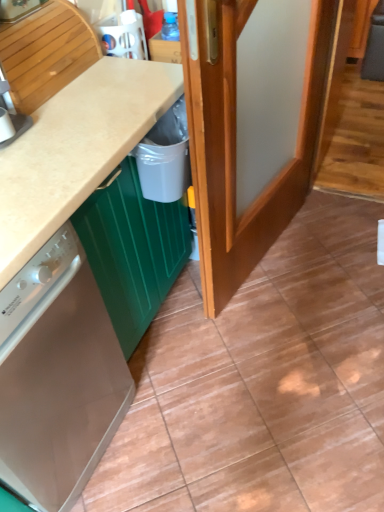
Find the location of a particular element. brushed metal dishwasher at left is located at coordinates (18, 9).

Image resolution: width=384 pixels, height=512 pixels. I want to click on beige matte countertop at center, so click(x=76, y=149).

What do you see at coordinates (236, 144) in the screenshot? The width and height of the screenshot is (384, 512). I see `wooden door at center` at bounding box center [236, 144].

The height and width of the screenshot is (512, 384). Describe the element at coordinates (165, 157) in the screenshot. I see `white plastic bin at lower center` at that location.

Locate an element on the screen. This screenshot has height=512, width=384. brushed metal dishwasher at left is located at coordinates (18, 9).

Can you see satin white dishwasher at lower left touching beige matte countertop at center?

satin white dishwasher at lower left is not next to beige matte countertop at center, and they're not touching.

From a real-world perspective, is satin white dishwasher at lower left located beneath beige matte countertop at center?

No.

From the image's perspective, is satin white dishwasher at lower left positioned above or below beige matte countertop at center?

satin white dishwasher at lower left is below beige matte countertop at center.

Is satin white dishwasher at lower left oriented away from beige matte countertop at center?

No, satin white dishwasher at lower left is not facing the opposite direction of beige matte countertop at center.

Who is taller, wooden door at center or brushed metal dishwasher at left?

wooden door at center.

From a real-world perspective, who is located higher, wooden door at center or brushed metal dishwasher at left?

brushed metal dishwasher at left is physically above.

How distant is wooden door at center from brushed metal dishwasher at left?

wooden door at center and brushed metal dishwasher at left are 86.07 centimeters apart.

Based on their sizes in the image, would you say wooden door at center is bigger or smaller than brushed metal dishwasher at left?

Clearly, wooden door at center is larger in size than brushed metal dishwasher at left.

Considering the relative positions of brushed metal dishwasher at left and beige matte countertop at center in the image provided, is brushed metal dishwasher at left in front of beige matte countertop at center?

No, brushed metal dishwasher at left is further to the viewer.

From the image's perspective, relative to beige matte countertop at center, is brushed metal dishwasher at left above or below?

From the image's perspective, brushed metal dishwasher at left appears above beige matte countertop at center.

Does point (16, 16) come behind point (148, 101)?

That is True.

Considering the relative positions of brushed metal dishwasher at left and beige matte countertop at center in the image provided, is brushed metal dishwasher at left to the right of beige matte countertop at center from the viewer's perspective?

No.

In the image, is white plastic bin at lower center on the left side or the right side of beige matte countertop at center?

white plastic bin at lower center is positioned on beige matte countertop at center's right side.

Considering the positions of objects white plastic bin at lower center and beige matte countertop at center in the image provided, who is in front, white plastic bin at lower center or beige matte countertop at center?

Positioned in front is beige matte countertop at center.

Between point (179, 17) and point (163, 175), which one is positioned behind?

The point (163, 175) is behind.

Consider the image. Is there a large distance between wooden door at center and white plastic bin at lower center?

That's not correct — wooden door at center is a little close to white plastic bin at lower center.

Could you tell me if wooden door at center is turned towards white plastic bin at lower center?

No, wooden door at center is not aimed at white plastic bin at lower center.

Does wooden door at center have a larger size compared to white plastic bin at lower center?

Correct, wooden door at center is larger in size than white plastic bin at lower center.

From the image's perspective, is brushed metal dishwasher at left located beneath white plastic bin at lower center?

No.

At what (x,y) coordinates should I click in order to perform the action: click on kitchen appliance that is on the left side of white plastic bin at lower center. Please return your answer as a coordinate pair (x, y). The height and width of the screenshot is (512, 384). Looking at the image, I should click on [x=18, y=9].

Between brushed metal dishwasher at left and white plastic bin at lower center, which one appears on the right side from the viewer's perspective?

white plastic bin at lower center.

Looking at this image, between brushed metal dishwasher at left and white plastic bin at lower center, which one has larger width?

brushed metal dishwasher at left.

Is satin white dishwasher at lower left not near wooden door at center?

That's not correct — satin white dishwasher at lower left is a little close to wooden door at center.

Is satin white dishwasher at lower left bigger or smaller than wooden door at center?

satin white dishwasher at lower left is bigger than wooden door at center.

Is satin white dishwasher at lower left positioned with its back to wooden door at center?

No, satin white dishwasher at lower left's orientation is not away from wooden door at center.

Where is `home appliance below the beige matte countertop at center (from the image's perspective)`? home appliance below the beige matte countertop at center (from the image's perspective) is located at coordinates (57, 376).

Locate an element on the screen. This screenshot has width=384, height=512. kitchen appliance located above the wooden door at center (from a real-world perspective) is located at coordinates (18, 9).

Which object lies further to the anchor point beige matte countertop at center, brushed metal dishwasher at left or satin white dishwasher at lower left?

satin white dishwasher at lower left is further to beige matte countertop at center.

Estimate the real-world distances between objects in this image. Which object is further from white plastic bin at lower center, beige matte countertop at center or satin white dishwasher at lower left?

satin white dishwasher at lower left is positioned further to the anchor white plastic bin at lower center.

When comparing their distances from satin white dishwasher at lower left, does wooden door at center or brushed metal dishwasher at left seem closer?

wooden door at center lies closer to satin white dishwasher at lower left than the other object.

When comparing their distances from brushed metal dishwasher at left, does white plastic bin at lower center or satin white dishwasher at lower left seem further?

The object further to brushed metal dishwasher at left is satin white dishwasher at lower left.

When comparing their distances from wooden door at center, does brushed metal dishwasher at left or satin white dishwasher at lower left seem further?

The object further to wooden door at center is brushed metal dishwasher at left.

Looking at the image, which one is located further to wooden door at center, white plastic bin at lower center or brushed metal dishwasher at left?

Among the two, brushed metal dishwasher at left is located further to wooden door at center.

When comparing their distances from satin white dishwasher at lower left, does wooden door at center or beige matte countertop at center seem further?

beige matte countertop at center lies further to satin white dishwasher at lower left than the other object.

Based on the photo, when comparing their distances from brushed metal dishwasher at left, does beige matte countertop at center or satin white dishwasher at lower left seem further?

Among the two, satin white dishwasher at lower left is located further to brushed metal dishwasher at left.

Identify the location of countertop between brushed metal dishwasher at left and wooden door at center. (76, 149).

The image size is (384, 512). In order to click on recycling bin located between satin white dishwasher at lower left and wooden door at center in the left-right direction in this screenshot , I will do `click(165, 157)`.

Image resolution: width=384 pixels, height=512 pixels. What are the coordinates of `recycling bin between brushed metal dishwasher at left and wooden door at center` in the screenshot? It's located at (165, 157).

The height and width of the screenshot is (512, 384). What are the coordinates of `kitchen appliance between satin white dishwasher at lower left and wooden door at center` in the screenshot? It's located at (18, 9).